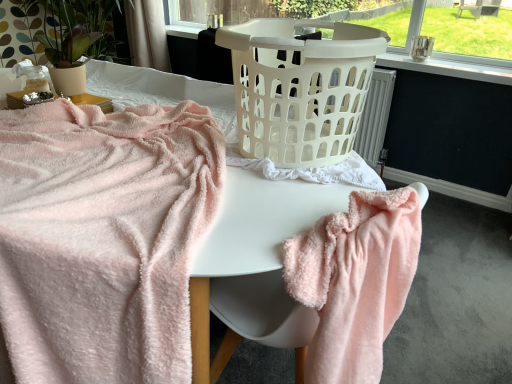
Question: Does soft pink plush towel at left, arranged as the second towel when viewed from the right, have a larger size compared to white plastic laundry basket at center?

Choices:
 (A) yes
 (B) no

Answer: (A)

Question: Can you see soft pink plush towel at left, arranged as the second towel when viewed from the right, touching white plastic laundry basket at center?

Choices:
 (A) yes
 (B) no

Answer: (B)

Question: Is soft pink plush towel at left, acting as the 1th towel starting from the left, at the right side of white plastic laundry basket at center?

Choices:
 (A) no
 (B) yes

Answer: (A)

Question: Can you confirm if soft pink plush towel at left, arranged as the second towel when viewed from the right, is taller than white plastic laundry basket at center?

Choices:
 (A) yes
 (B) no

Answer: (A)

Question: From a real-world perspective, is soft pink plush towel at left, arranged as the second towel when viewed from the right, on white plastic laundry basket at center?

Choices:
 (A) no
 (B) yes

Answer: (A)

Question: From a real-world perspective, is fluffy pink towel at lower right, which appears as the 1th towel when viewed from the right, positioned above or below white plastic laundry basket at center?

Choices:
 (A) above
 (B) below

Answer: (A)

Question: Relative to white plastic laundry basket at center, is fluffy pink towel at lower right, which appears as the 1th towel when viewed from the right, in front or behind?

Choices:
 (A) front
 (B) behind

Answer: (A)

Question: Does point (368, 301) appear closer or farther from the camera than point (220, 355)?

Choices:
 (A) closer
 (B) farther

Answer: (A)

Question: In terms of height, does fluffy pink towel at lower right, placed as the second towel when sorted from left to right, look taller or shorter compared to white plastic laundry basket at center?

Choices:
 (A) short
 (B) tall

Answer: (B)

Question: Visually, is white plastic laundry basket at upper center positioned to the left or to the right of white sheer curtain at upper center?

Choices:
 (A) right
 (B) left

Answer: (A)

Question: Is white plastic laundry basket at upper center taller or shorter than white sheer curtain at upper center?

Choices:
 (A) short
 (B) tall

Answer: (A)

Question: Does point (503, 79) appear closer or farther from the camera than point (151, 14)?

Choices:
 (A) closer
 (B) farther

Answer: (A)

Question: Is white plastic laundry basket at upper center wider or thinner than white sheer curtain at upper center?

Choices:
 (A) wide
 (B) thin

Answer: (B)

Question: Considering the relative positions of white plastic laundry basket at center and soft pink plush towel at left, arranged as the second towel when viewed from the right, in the image provided, is white plastic laundry basket at center to the left or to the right of soft pink plush towel at left, arranged as the second towel when viewed from the right,?

Choices:
 (A) right
 (B) left

Answer: (A)

Question: Choose the correct answer: Is white plastic laundry basket at center inside soft pink plush towel at left, acting as the 1th towel starting from the left, or outside it?

Choices:
 (A) outside
 (B) inside

Answer: (A)